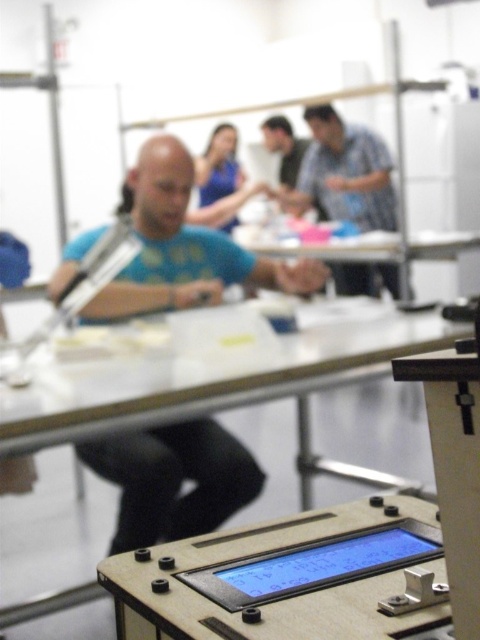
Is point (418, 275) positioned behind point (207, 198)?

Yes, it is.

Who is lower down, white glossy table at center or blue fabric shirt at upper center?

white glossy table at center is below.

Who is more forward, (421,252) or (219,166)?

Point (421,252)

You are a GUI agent. You are given a task and a screenshot of the screen. Output one action in this format:
    pyautogui.click(x=<x>, y=<y>)
    Task: Click on the white glossy table at center
    Image resolution: width=480 pixels, height=640 pixels.
    Given the screenshot: What is the action you would take?
    pyautogui.click(x=324, y=246)

Can you confirm if matte blue shirt at upper center is thinner than white glossy table at center?

Indeed, matte blue shirt at upper center has a lesser width compared to white glossy table at center.

Is matte blue shirt at upper center above white glossy table at center?

Yes.

The width and height of the screenshot is (480, 640). Identify the location of matte blue shirt at upper center. (345, 173).

In the scene shown: Who is more forward, (328,204) or (228,132)?

Point (328,204) is in front.

Is point (388, 189) less distant than point (232, 224)?

That is True.

Who is more forward, (350, 141) or (217, 160)?

Point (350, 141) is in front.

Locate an element on the screen. The height and width of the screenshot is (640, 480). matte blue shirt at upper center is located at coordinates pos(345,173).